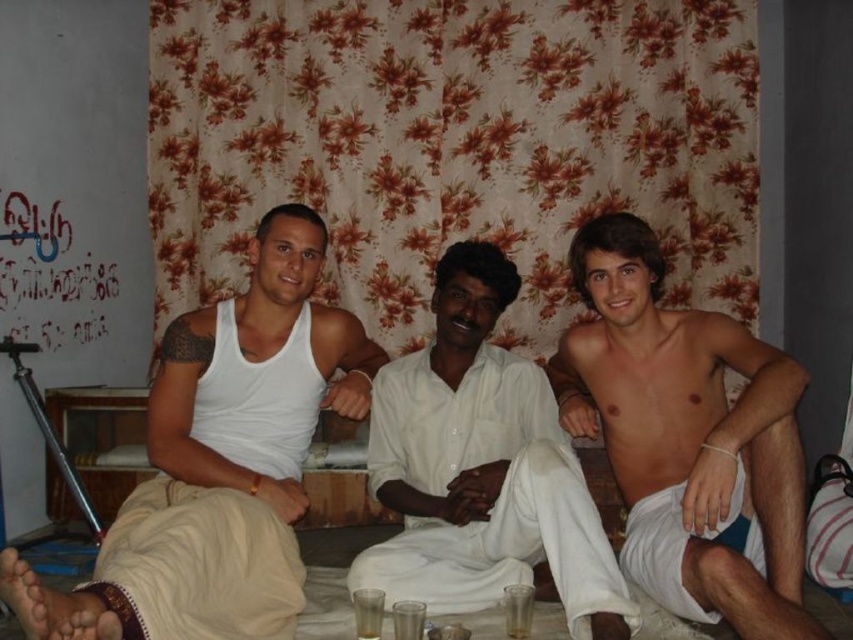
Between point (519, 600) and point (379, 627), which one is positioned in front?

Point (519, 600)

Between transparent plastic cup at lower center and translucent glass at center, which one has more height?

transparent plastic cup at lower center is taller.

The width and height of the screenshot is (853, 640). What do you see at coordinates (518, 611) in the screenshot?
I see `transparent plastic cup at lower center` at bounding box center [518, 611].

The width and height of the screenshot is (853, 640). What are the coordinates of `transparent plastic cup at lower center` in the screenshot? It's located at (518, 611).

Is white cotton shirt at center above transparent plastic cup at lower center?

Yes.

Is white cotton shirt at center positioned in front of transparent plastic cup at lower center?

Yes, white cotton shirt at center is in front of transparent plastic cup at lower center.

Between point (454, 442) and point (514, 620), which one is positioned behind?

The point (454, 442) is behind.

Find the location of a particular element. The image size is (853, 640). white cotton shirt at center is located at coordinates (482, 467).

Does white matte tank top at left appear on the left side of shiny white shorts at right?

Yes, white matte tank top at left is to the left of shiny white shorts at right.

Can you confirm if white matte tank top at left is taller than shiny white shorts at right?

Yes.

This screenshot has height=640, width=853. What are the coordinates of `white matte tank top at left` in the screenshot? It's located at (219, 461).

At what (x,y) coordinates should I click in order to perform the action: click on white matte tank top at left. Please return your answer as a coordinate pair (x, y). The image size is (853, 640). Looking at the image, I should click on 219,461.